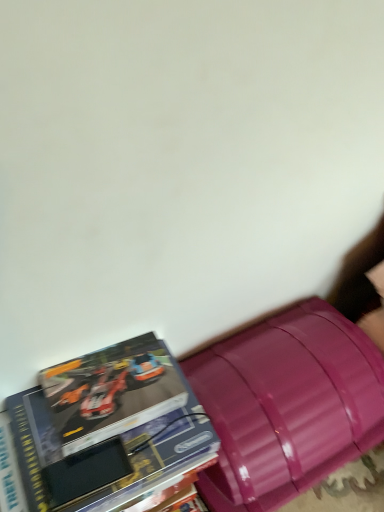
This screenshot has width=384, height=512. I want to click on hardcover book at lower left, so click(x=110, y=429).

What is the approximate width of hardcover book at lower left?

hardcover book at lower left is 12.48 inches wide.

Describe the element at coordinates (110, 429) in the screenshot. Image resolution: width=384 pixels, height=512 pixels. I see `hardcover book at lower left` at that location.

Locate an element on the screen. This screenshot has height=512, width=384. hardcover book at lower left is located at coordinates (110, 429).